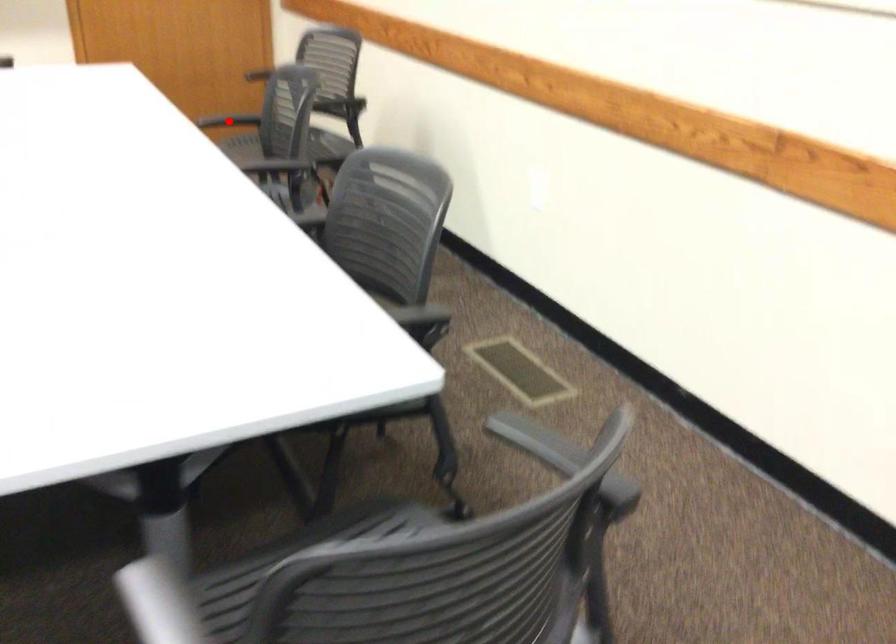
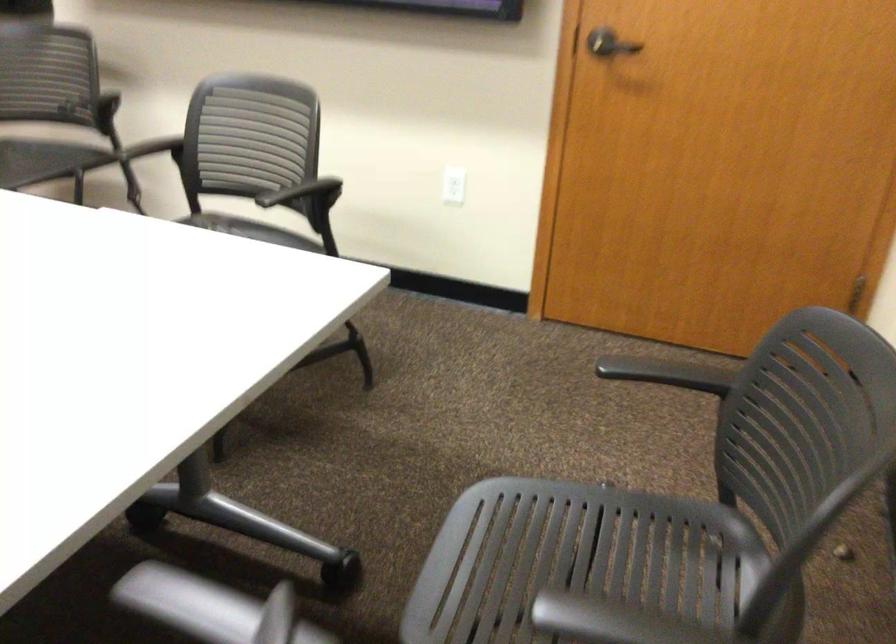
Question: I am providing you with two images of the same scene from different viewpoints. A red point is marked on the first image. Is the red point's position out of view in image 2?

Choices:
 (A) Yes
 (B) No

Answer: (A)